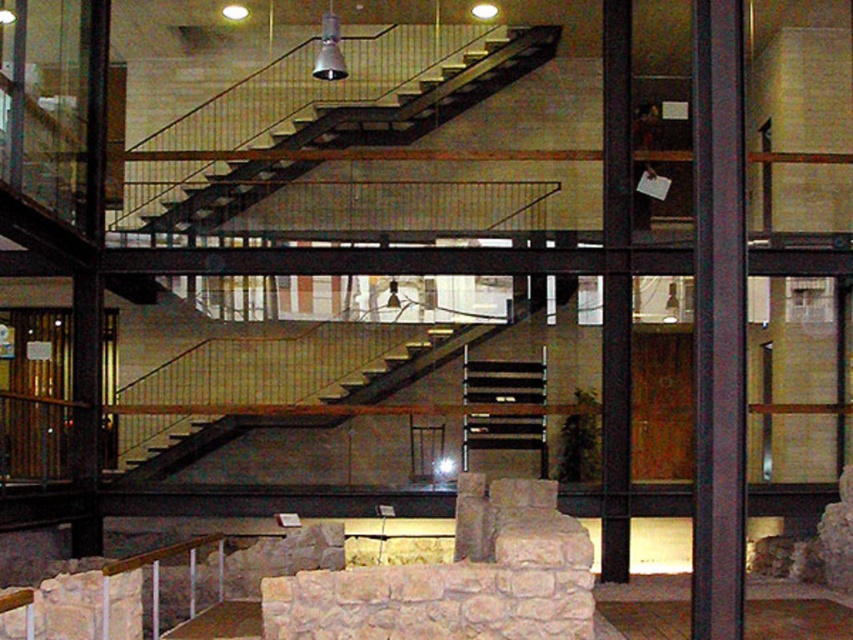
Which is in front, point (254, 192) or point (737, 12)?

Positioned in front is point (737, 12).

Is metallic staircase at center smaller than dark brown wood pillar at right?

Yes, metallic staircase at center is smaller than dark brown wood pillar at right.

Between point (308, 129) and point (730, 387), which one is positioned behind?

The point (308, 129) is behind.

Where is `metallic staircase at center`? The image size is (853, 640). metallic staircase at center is located at coordinates (314, 129).